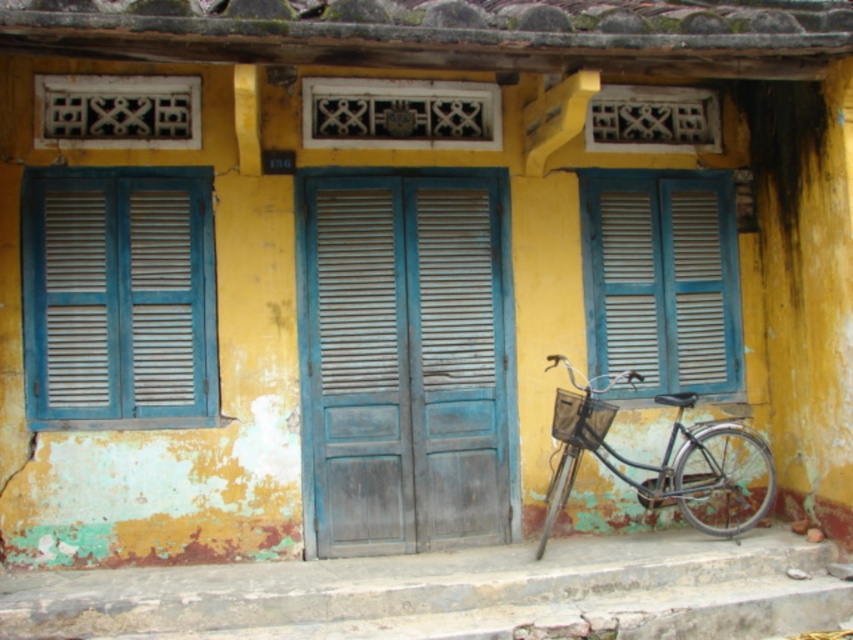
Does wooden at center have a greater height compared to metallic silver bicycle at right?

Yes.

Can you confirm if wooden at center is shorter than metallic silver bicycle at right?

No, wooden at center is not shorter than metallic silver bicycle at right.

Measure the distance between wooden at center and camera.

wooden at center and camera are 6.16 meters apart.

Find the location of a particular element. wooden at center is located at coordinates (404, 358).

Does point (453, 188) come behind point (785, 534)?

That is True.

Who is taller, wooden at center or concrete steps at lower center?

wooden at center is taller.

The image size is (853, 640). I want to click on wooden at center, so [x=404, y=358].

Is point (341, 554) less distant than point (605, 346)?

Yes.

Is point (316, 362) in front of point (701, 364)?

Yes, point (316, 362) is in front of point (701, 364).

This screenshot has width=853, height=640. In order to click on wooden at center in this screenshot , I will do `click(404, 358)`.